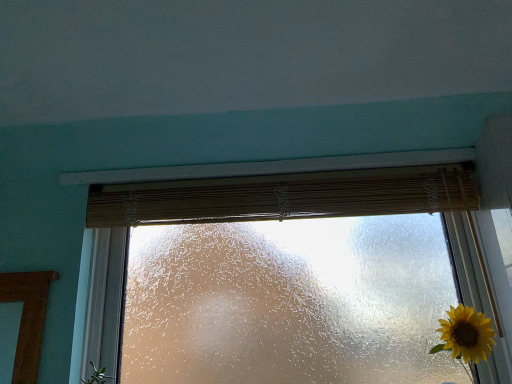
Question: Is the position of teal matte wall at upper center more distant than that of frosted glass window at center?

Choices:
 (A) no
 (B) yes

Answer: (A)

Question: Can you confirm if teal matte wall at upper center is bigger than frosted glass window at center?

Choices:
 (A) yes
 (B) no

Answer: (B)

Question: Can you confirm if teal matte wall at upper center is taller than frosted glass window at center?

Choices:
 (A) no
 (B) yes

Answer: (A)

Question: Is teal matte wall at upper center shorter than frosted glass window at center?

Choices:
 (A) no
 (B) yes

Answer: (B)

Question: Can you confirm if teal matte wall at upper center is thinner than frosted glass window at center?

Choices:
 (A) no
 (B) yes

Answer: (A)

Question: From the image's perspective, is frosted glass window at center located above or below bamboo curtain at center?

Choices:
 (A) above
 (B) below

Answer: (B)

Question: In terms of size, does frosted glass window at center appear bigger or smaller than bamboo curtain at center?

Choices:
 (A) small
 (B) big

Answer: (B)

Question: Which is correct: frosted glass window at center is inside bamboo curtain at center, or outside of it?

Choices:
 (A) inside
 (B) outside

Answer: (B)

Question: Visually, is frosted glass window at center positioned to the left or to the right of bamboo curtain at center?

Choices:
 (A) right
 (B) left

Answer: (A)

Question: From the image's perspective, is bamboo curtain at center above or below frosted glass window at center?

Choices:
 (A) above
 (B) below

Answer: (A)

Question: Considering the positions of point (272, 200) and point (372, 213), is point (272, 200) closer or farther from the camera than point (372, 213)?

Choices:
 (A) farther
 (B) closer

Answer: (A)

Question: Would you say bamboo curtain at center is to the left or to the right of frosted glass window at center in the picture?

Choices:
 (A) left
 (B) right

Answer: (A)

Question: Is bamboo curtain at center taller or shorter than frosted glass window at center?

Choices:
 (A) short
 (B) tall

Answer: (A)

Question: From the image's perspective, is teal matte wall at upper center located above or below bamboo curtain at center?

Choices:
 (A) above
 (B) below

Answer: (A)

Question: From a real-world perspective, is teal matte wall at upper center above or below bamboo curtain at center?

Choices:
 (A) below
 (B) above

Answer: (B)